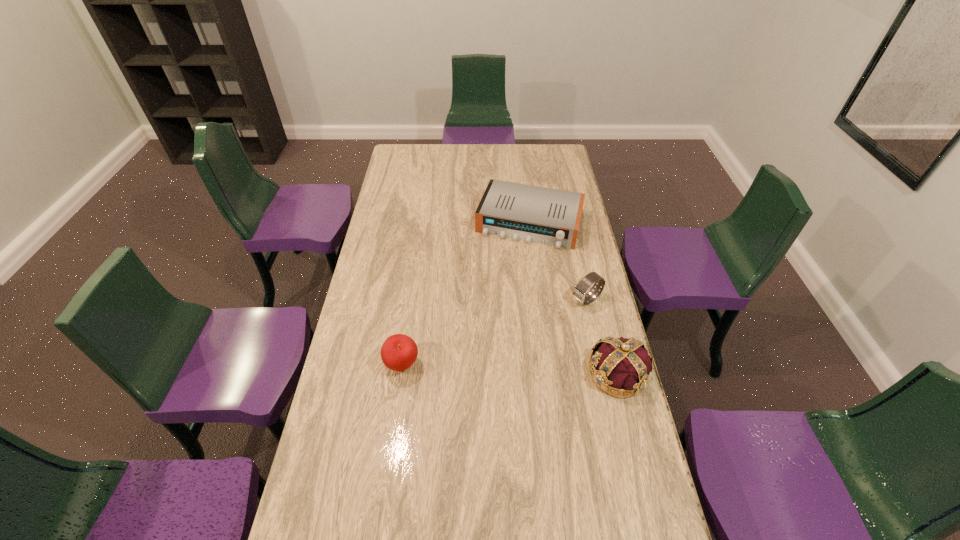
Identify the location of empty space that is in between the apple and the farthest object. (466, 294).

The height and width of the screenshot is (540, 960). Find the location of `vacant point located between the farthest object and the watch`. vacant point located between the farthest object and the watch is located at coordinates (558, 261).

Locate an element on the screen. Image resolution: width=960 pixels, height=540 pixels. object identified as the third closest to the tallest object is located at coordinates (398, 352).

Locate which object is the second closest to the second farthest object. Please provide its 2D coordinates. Your answer should be formatted as a tuple, i.e. [(x, y)], where the tuple contains the x and y coordinates of a point satisfying the conditions above.

[(548, 216)]